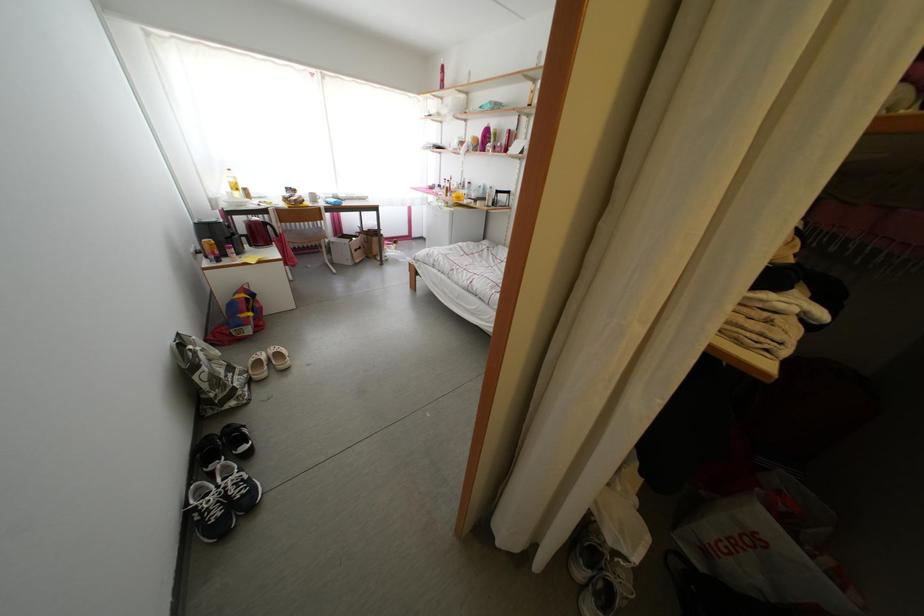
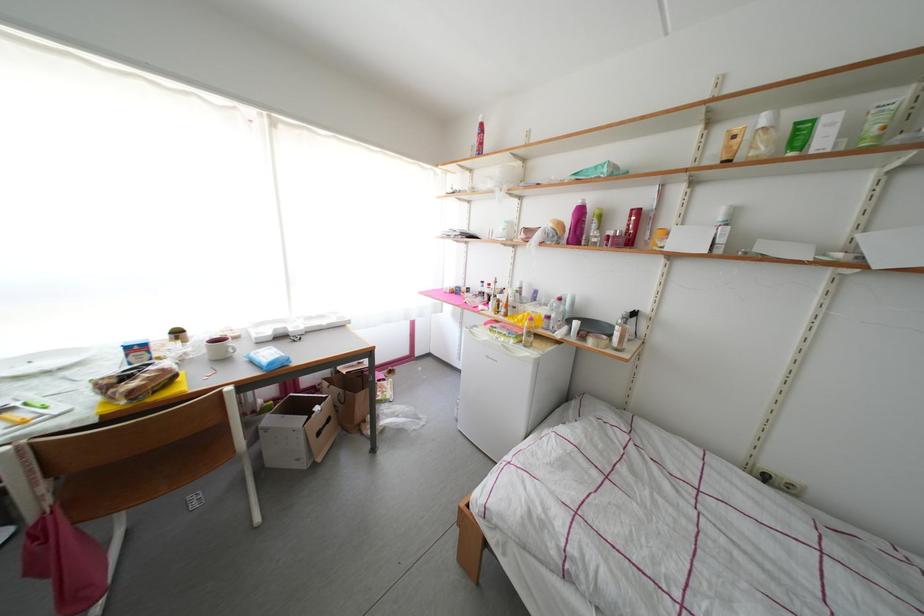
Which direction would the cameraman need to move to produce the second image?

The cameraman walked toward left, forward.